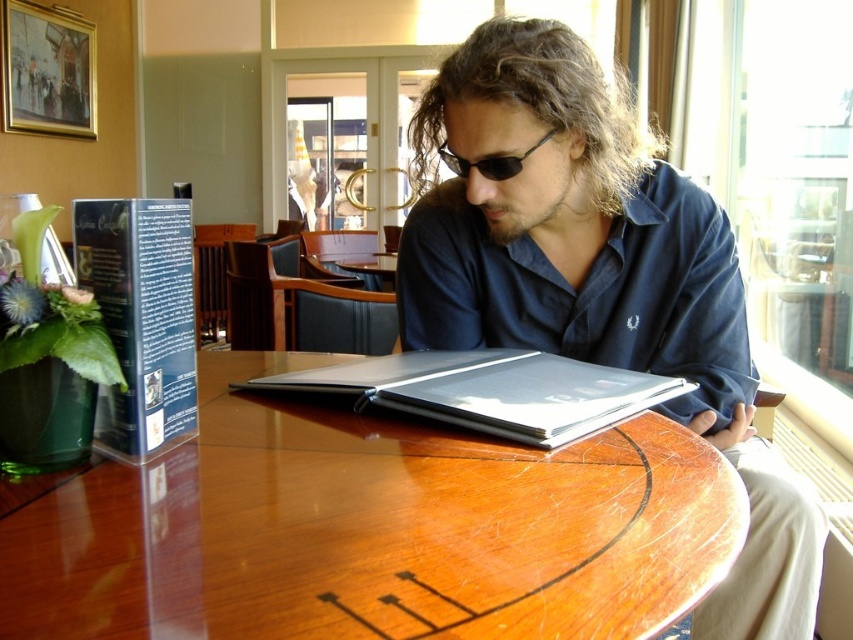
Who is more distant from viewer, [155,362] or [509,161]?

Positioned behind is point [509,161].

Does blue hardcover book at left appear on the right side of sunglasses at center?

No, blue hardcover book at left is not to the right of sunglasses at center.

Which is behind, point (184, 273) or point (483, 160)?

The point (483, 160) is behind.

Locate an element on the screen. This screenshot has height=640, width=853. blue hardcover book at left is located at coordinates (141, 317).

Measure the distance from blue hardcover book at left to silver metallic book at center.

blue hardcover book at left is 12.90 inches from silver metallic book at center.

Between blue hardcover book at left and silver metallic book at center, which one appears on the left side from the viewer's perspective?

Positioned to the left is blue hardcover book at left.

I want to click on blue hardcover book at left, so click(141, 317).

The width and height of the screenshot is (853, 640). I want to click on blue hardcover book at left, so click(x=141, y=317).

Does shiny wood table at center appear on the left side of blue hardcover book at left?

In fact, shiny wood table at center is to the right of blue hardcover book at left.

Who is more distant from viewer, [384,525] or [144,416]?

Point [144,416]

Is point (578, 468) positioned behind point (167, 260)?

No, (578, 468) is closer to viewer.

Where is `shiny wood table at center`? The height and width of the screenshot is (640, 853). shiny wood table at center is located at coordinates (370, 531).